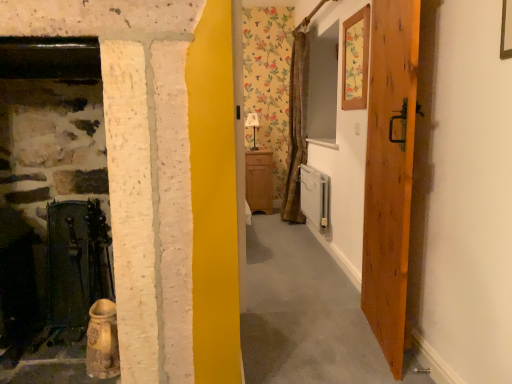
Where is `wooden door at right`? wooden door at right is located at coordinates (390, 173).

The height and width of the screenshot is (384, 512). What do you see at coordinates (315, 198) in the screenshot?
I see `white glossy radiator at lower right` at bounding box center [315, 198].

Find the location of a particular element. The width and height of the screenshot is (512, 384). wooden door at right is located at coordinates (390, 173).

From the image's perspective, which one is positioned lower, white glossy radiator at lower right or wooden door at right?

white glossy radiator at lower right.

Between white glossy radiator at lower right and wooden door at right, which one has larger width?

wooden door at right is wider.

Could you tell me if white glossy radiator at lower right is facing wooden door at right?

No, white glossy radiator at lower right is not oriented towards wooden door at right.

Measure the distance from white glossy radiator at lower right to wooden door at right.

They are 5.63 feet apart.

Considering the positions of objects matte white lamp at center and white glossy radiator at lower right in the image provided, who is more to the left, matte white lamp at center or white glossy radiator at lower right?

matte white lamp at center is more to the left.

From the image's perspective, is matte white lamp at center under white glossy radiator at lower right?

No, from the image's perspective, matte white lamp at center is not beneath white glossy radiator at lower right.

Where is `lamp positioned vertically above the white glossy radiator at lower right (from a real-world perspective)`? The width and height of the screenshot is (512, 384). lamp positioned vertically above the white glossy radiator at lower right (from a real-world perspective) is located at coordinates (253, 127).

Are matte white lamp at center and white glossy radiator at lower right located far from each other?

Yes, matte white lamp at center is far from white glossy radiator at lower right.

From the image's perspective, is matte white lamp at center above or below wooden door at right?

matte white lamp at center is above wooden door at right.

Which of these two, matte white lamp at center or wooden door at right, is bigger?

Bigger between the two is wooden door at right.

From a real-world perspective, is matte white lamp at center under wooden door at right?

No.

Is matte white lamp at center next to wooden door at right?

matte white lamp at center and wooden door at right are not in contact.

Is white glossy radiator at lower right wider or thinner than matte wood cabinet at center?

Clearly, white glossy radiator at lower right has less width compared to matte wood cabinet at center.

From a real-world perspective, is white glossy radiator at lower right on top of matte wood cabinet at center?

Indeed, from a real-world perspective, white glossy radiator at lower right stands above matte wood cabinet at center.

The width and height of the screenshot is (512, 384). Identify the location of cabinetry below the white glossy radiator at lower right (from a real-world perspective). (259, 181).

Does white glossy radiator at lower right turn towards matte wood cabinet at center?

No, white glossy radiator at lower right is not turned towards matte wood cabinet at center.

Considering the sizes of wooden door at right and wooden picture frame at upper right in the image, is wooden door at right taller or shorter than wooden picture frame at upper right?

Considering their sizes, wooden door at right has more height than wooden picture frame at upper right.

Can you confirm if wooden door at right is smaller than wooden picture frame at upper right?

No.

Is wooden door at right touching wooden picture frame at upper right?

No, wooden door at right is not touching wooden picture frame at upper right.

Which of these two, matte wood cabinet at center or matte white lamp at center, is smaller?

Smaller between the two is matte white lamp at center.

Which is more to the right, matte wood cabinet at center or matte white lamp at center?

matte wood cabinet at center is more to the right.

Is matte wood cabinet at center shorter than matte white lamp at center?

In fact, matte wood cabinet at center may be taller than matte white lamp at center.

Do you think matte wood cabinet at center is within matte white lamp at center, or outside of it?

matte wood cabinet at center exists outside the volume of matte white lamp at center.

Where is `picture frame above the matte white lamp at center (from the image's perspective)`? The height and width of the screenshot is (384, 512). picture frame above the matte white lamp at center (from the image's perspective) is located at coordinates (355, 60).

Can you confirm if wooden picture frame at upper right is positioned to the left of matte white lamp at center?

Incorrect, wooden picture frame at upper right is not on the left side of matte white lamp at center.

Does point (356, 108) lie behind point (257, 116)?

No.

Consider the image. Can you confirm if wooden picture frame at upper right is shorter than matte white lamp at center?

In fact, wooden picture frame at upper right may be taller than matte white lamp at center.

You are a GUI agent. You are given a task and a screenshot of the screen. Output one action in this format:
    pyautogui.click(x=<x>, y=<y>)
    Task: Click on the appliance that appears below the wooden door at right (from the image's perspective)
    This screenshot has height=384, width=512.
    Given the screenshot: What is the action you would take?
    pyautogui.click(x=315, y=198)

The image size is (512, 384). I want to click on appliance on the right of matte white lamp at center, so click(x=315, y=198).

Considering their positions, is wooden picture frame at upper right positioned further to matte wood cabinet at center than white glossy radiator at lower right?

Among the two, wooden picture frame at upper right is located further to matte wood cabinet at center.

Looking at the image, which one is located further to matte wood cabinet at center, matte white lamp at center or wooden picture frame at upper right?

wooden picture frame at upper right lies further to matte wood cabinet at center than the other object.

Looking at the image, which one is located further to matte white lamp at center, matte wood cabinet at center or wooden door at right?

wooden door at right lies further to matte white lamp at center than the other object.

Based on their spatial positions, is matte white lamp at center or matte wood cabinet at center further from wooden door at right?

matte white lamp at center.

Which object lies nearer to the anchor point white glossy radiator at lower right, wooden picture frame at upper right or matte wood cabinet at center?

matte wood cabinet at center is closer to white glossy radiator at lower right.

From the image, which object appears to be farther from white glossy radiator at lower right, wooden picture frame at upper right or wooden door at right?

wooden door at right.

From the image, which object appears to be farther from matte wood cabinet at center, matte white lamp at center or white glossy radiator at lower right?

white glossy radiator at lower right is further to matte wood cabinet at center.

Looking at the image, which one is located further to white glossy radiator at lower right, wooden door at right or matte white lamp at center?

Based on the image, wooden door at right appears to be further to white glossy radiator at lower right.

At what (x,y) coordinates should I click in order to perform the action: click on cabinetry between wooden door at right and matte white lamp at center from front to back. Please return your answer as a coordinate pair (x, y). Image resolution: width=512 pixels, height=384 pixels. Looking at the image, I should click on (259, 181).

Identify the location of appliance located between wooden picture frame at upper right and matte wood cabinet at center in the depth direction. (315, 198).

What are the coordinates of `appliance between wooden picture frame at upper right and matte white lamp at center from front to back` in the screenshot? It's located at (315, 198).

Identify the location of cabinetry positioned between wooden picture frame at upper right and matte white lamp at center from near to far. This screenshot has width=512, height=384. (259, 181).